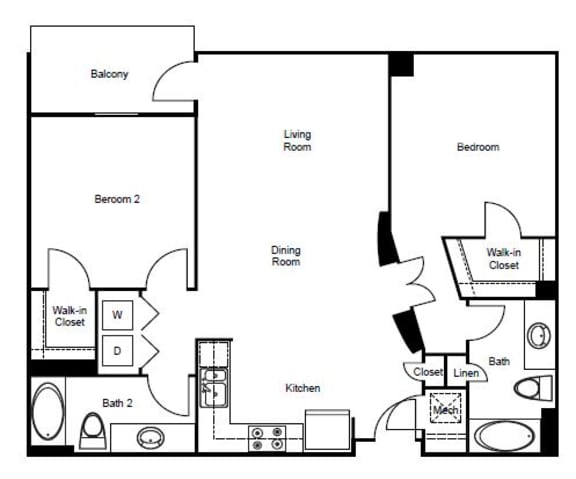
You are a GUI agent. You are given a task and a screenshot of the screen. Output one action in this format:
    pyautogui.click(x=<x>, y=<y>)
    Task: Click on the stove
    The width and height of the screenshot is (576, 479).
    Given the screenshot: What is the action you would take?
    pyautogui.click(x=276, y=438)